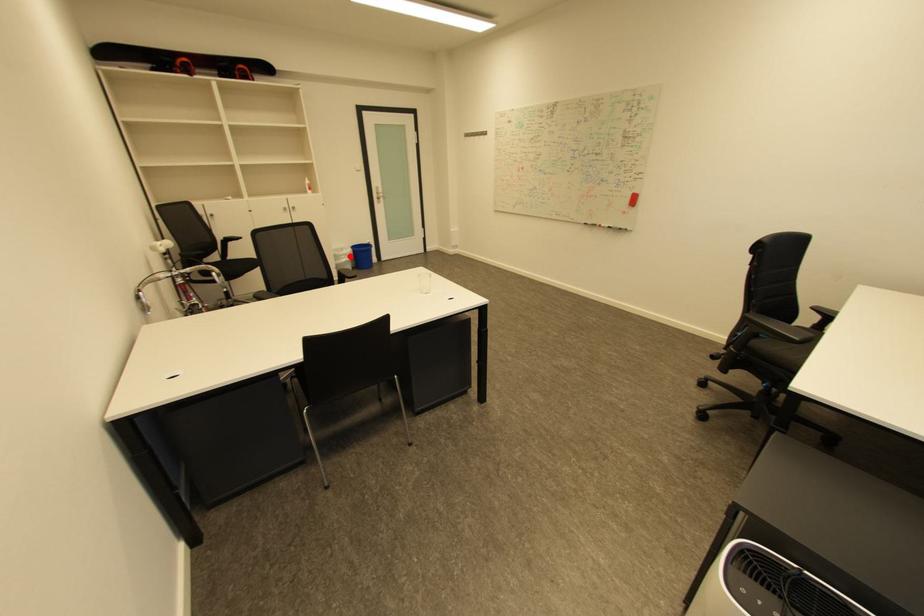
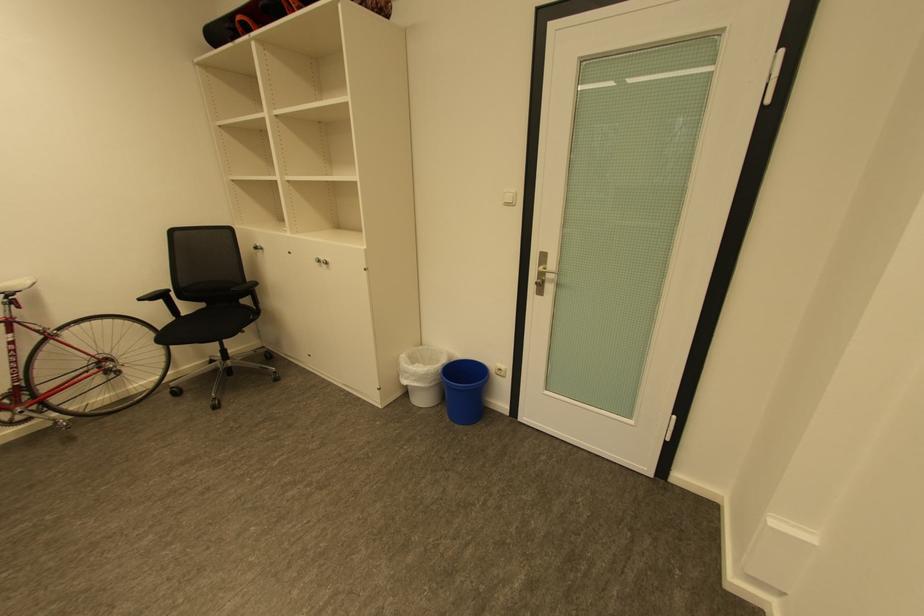
The point at the highlighted location is marked in the first image. Where is the corresponding point in the second image?

(414, 373)